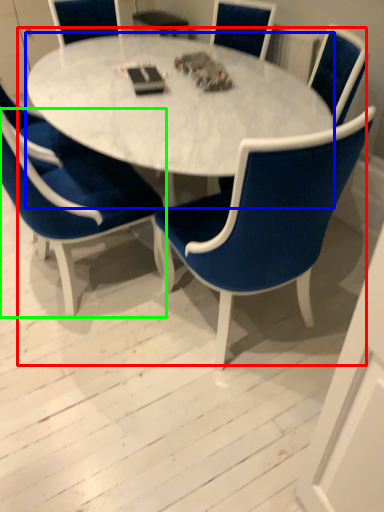
Question: Which is farther away from kitchen & dining room table (highlighted by a red box)? coffee table (highlighted by a blue box) or chair (highlighted by a green box)?

Choices:
 (A) coffee table
 (B) chair

Answer: (B)